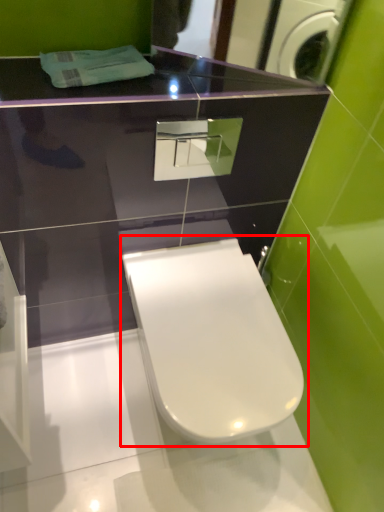
Question: In this image, where is toilet (annotated by the red box) located relative to mirror?

Choices:
 (A) right
 (B) left

Answer: (B)